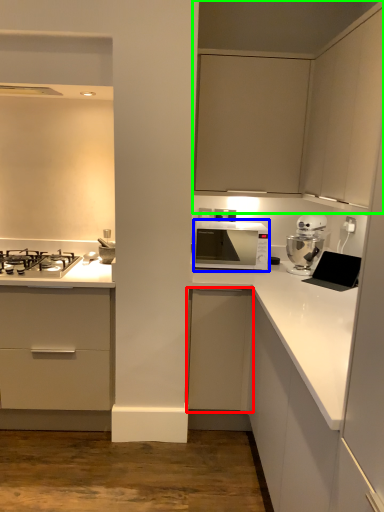
Question: Which object is positioned farthest from cabinetry (highlighted by a red box)? Select from microwave oven (highlighted by a blue box) and cabinetry (highlighted by a green box).

Choices:
 (A) microwave oven
 (B) cabinetry

Answer: (B)